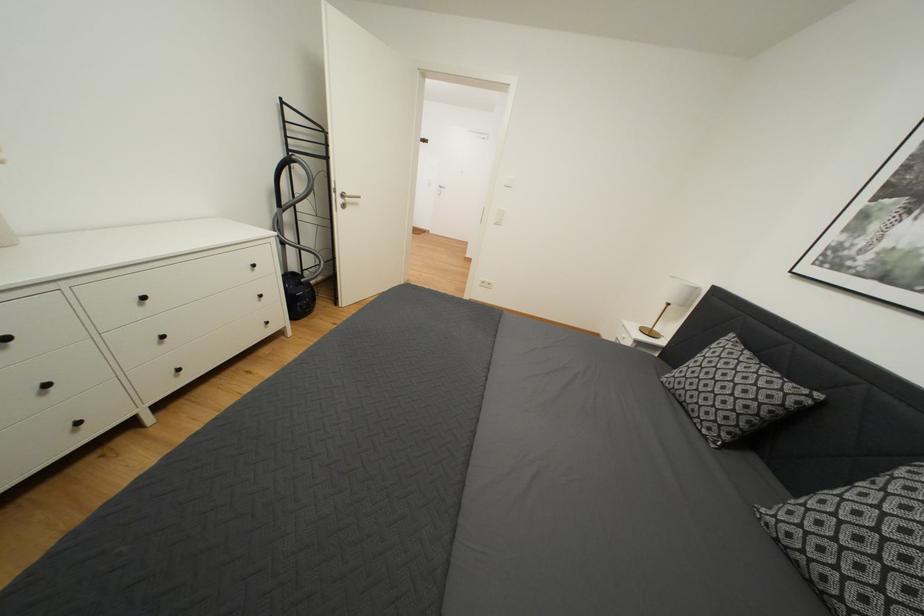
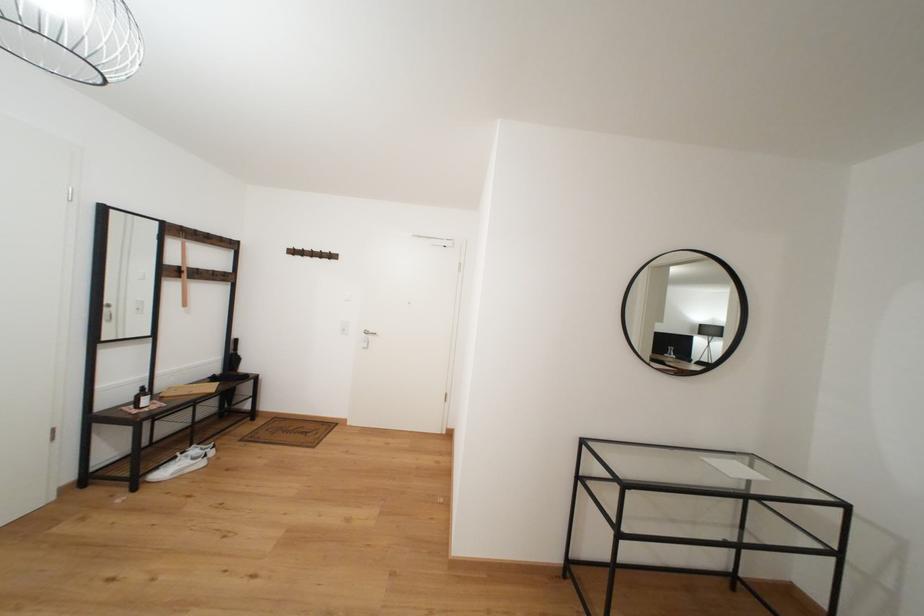
Question: In a continuous first-person perspective shot, in which direction is the camera moving?

Choices:
 (A) Left
 (B) Right
 (C) Forward
 (D) Backward

Answer: (C)